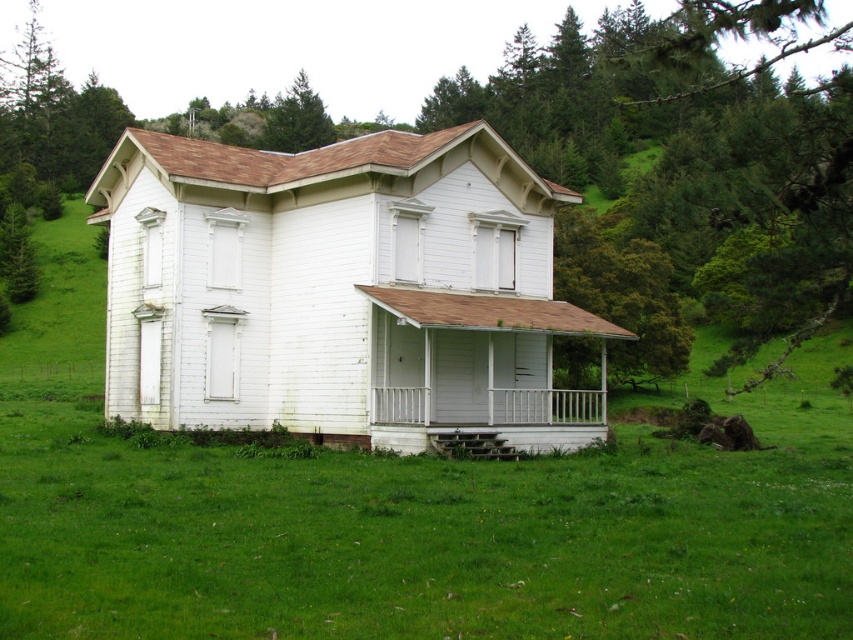
Does white wood house at center have a greater height compared to green textured tree at upper center?

Incorrect, white wood house at center's height is not larger of green textured tree at upper center's.

How much distance is there between white wood house at center and green textured tree at upper center?

The distance of white wood house at center from green textured tree at upper center is 111.87 meters.

Which is behind, point (398, 312) or point (305, 129)?

Point (305, 129)

The width and height of the screenshot is (853, 640). Identify the location of white wood house at center. (341, 291).

Is white wood house at center thinner than white wooden porch at center?

In fact, white wood house at center might be wider than white wooden porch at center.

This screenshot has width=853, height=640. Identify the location of white wood house at center. (341, 291).

Find the location of `white wood house at center`. white wood house at center is located at coordinates (341, 291).

Is white wooden porch at center smaller than green textured tree at upper center?

Yes, white wooden porch at center is smaller than green textured tree at upper center.

Where is `white wooden porch at center`? This screenshot has width=853, height=640. white wooden porch at center is located at coordinates (489, 420).

Who is more distant from viewer, (x=585, y=404) or (x=283, y=136)?

Positioned behind is point (x=283, y=136).

Where is `white wooden porch at center`? The height and width of the screenshot is (640, 853). white wooden porch at center is located at coordinates (489, 420).